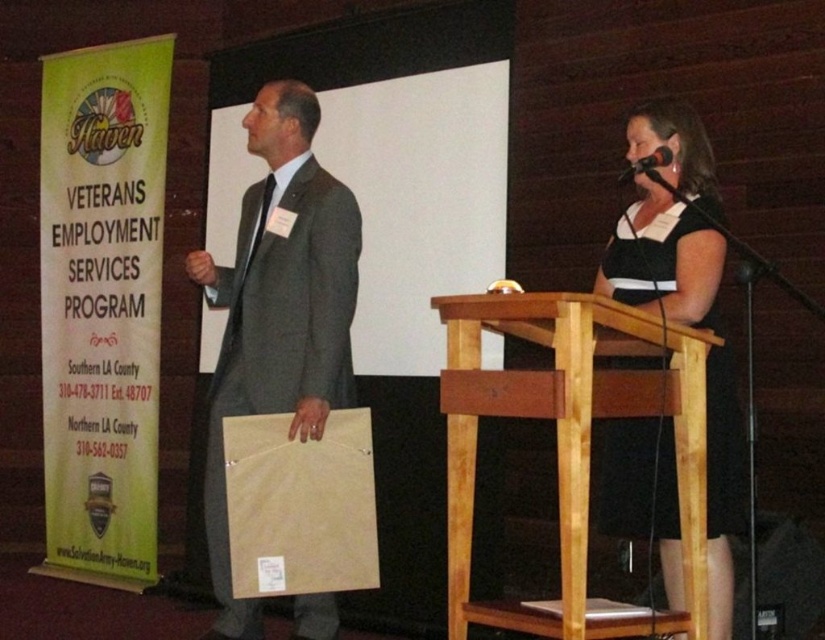
You are an event planner organizing a photo shoot for the event. You need to ensure the black satin dress at center and the black plastic microphone at upper right are visible in the photo. Given their sizes, which object should be placed closer to the camera to maintain visibility?

The black satin dress at center is larger in size than the black plastic microphone at upper right, so placing the black plastic microphone at upper right closer to the camera will help maintain visibility since smaller objects need to be nearer to appear prominent in photos.

You are an event organizer who needs to ensure that the black satin dress at center and the black plastic microphone at upper right can fit on a shelf that is 1.2 meters wide. Based on the scene description, will both items fit on the shelf together?

The black satin dress at center is wider than the black plastic microphone at upper right. However, without specific measurements for each item, it is impossible to determine if their combined width will exceed the 1.2 meter shelf. Additional information about their individual widths is needed to answer this question accurately.